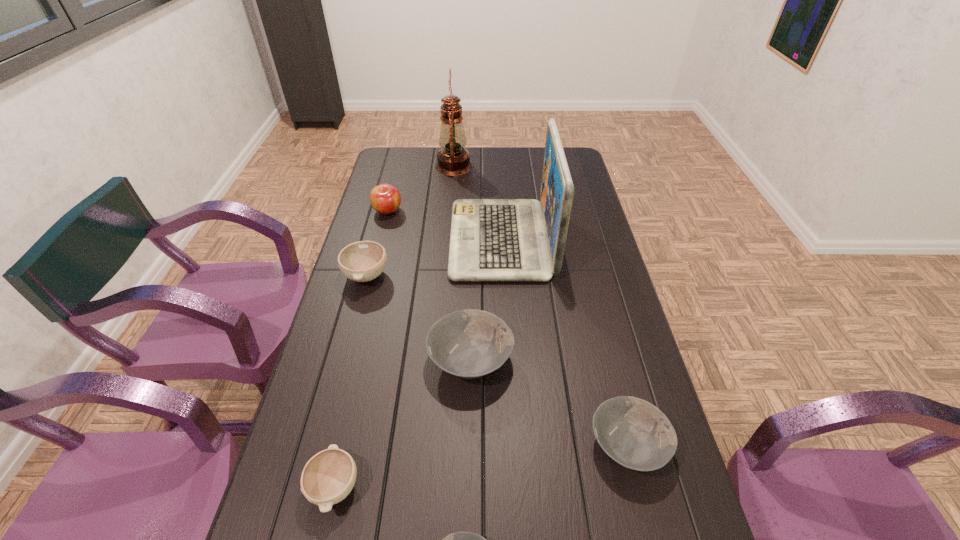
Where is `free space located on the left of the farthest object`? Image resolution: width=960 pixels, height=540 pixels. free space located on the left of the farthest object is located at coordinates (380, 166).

Find the location of a particular element. The image size is (960, 540). free spot located on the screen of the laptop computer is located at coordinates (385, 240).

Image resolution: width=960 pixels, height=540 pixels. I want to click on vacant space located 0.320m on the screen of the laptop computer, so click(x=359, y=240).

Locate an element on the screen. Image resolution: width=960 pixels, height=540 pixels. vacant space located on the screen of the laptop computer is located at coordinates (379, 240).

You are a GUI agent. You are given a task and a screenshot of the screen. Output one action in this format:
    pyautogui.click(x=<x>, y=<y>)
    Task: Click on the vacant space positioned on the back of the sixth shortest object
    This screenshot has height=540, width=960.
    Given the screenshot: What is the action you would take?
    pyautogui.click(x=402, y=152)

Locate an element on the screen. The width and height of the screenshot is (960, 540). vacant area situated 0.120m on the right of the farther beige bowl is located at coordinates (427, 275).

This screenshot has width=960, height=540. I want to click on vacant space situated 0.200m on the left of the fourth nearest object, so (x=354, y=359).

Where is `vacant region located 0.250m on the left of the second farthest gray bowl`? This screenshot has width=960, height=540. vacant region located 0.250m on the left of the second farthest gray bowl is located at coordinates (480, 444).

The height and width of the screenshot is (540, 960). Find the location of `vacant space located on the right of the nearer beige bowl`. vacant space located on the right of the nearer beige bowl is located at coordinates (384, 487).

In order to click on object present at the far edge in this screenshot , I will do `click(453, 159)`.